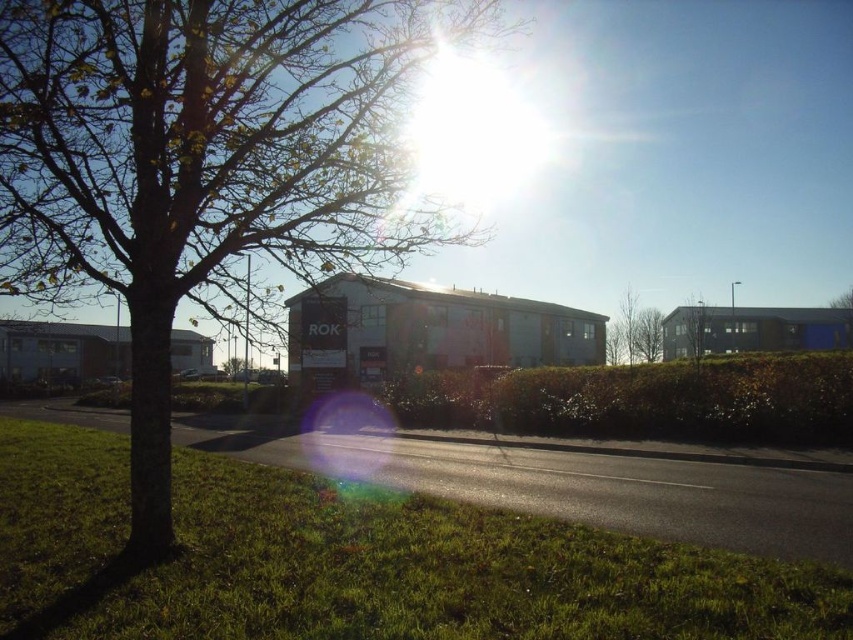
Question: Can you confirm if green leafy tree at upper center is positioned to the right of green leafy tree at center?

Choices:
 (A) yes
 (B) no

Answer: (B)

Question: Which of these objects is positioned farthest from the green leafy tree at upper center?

Choices:
 (A) brown bark tree at center
 (B) green grass at lower left

Answer: (B)

Question: Does brown bark tree at center appear on the left side of green leafy tree at center?

Choices:
 (A) yes
 (B) no

Answer: (A)

Question: Does brown bark tree at center have a greater width compared to green grass at lower left?

Choices:
 (A) yes
 (B) no

Answer: (A)

Question: Among these points, which one is nearest to the camera?

Choices:
 (A) (689, 348)
 (B) (352, 264)
 (C) (318, 634)

Answer: (C)

Question: Which point is closer to the camera?

Choices:
 (A) (695, 365)
 (B) (660, 323)

Answer: (A)